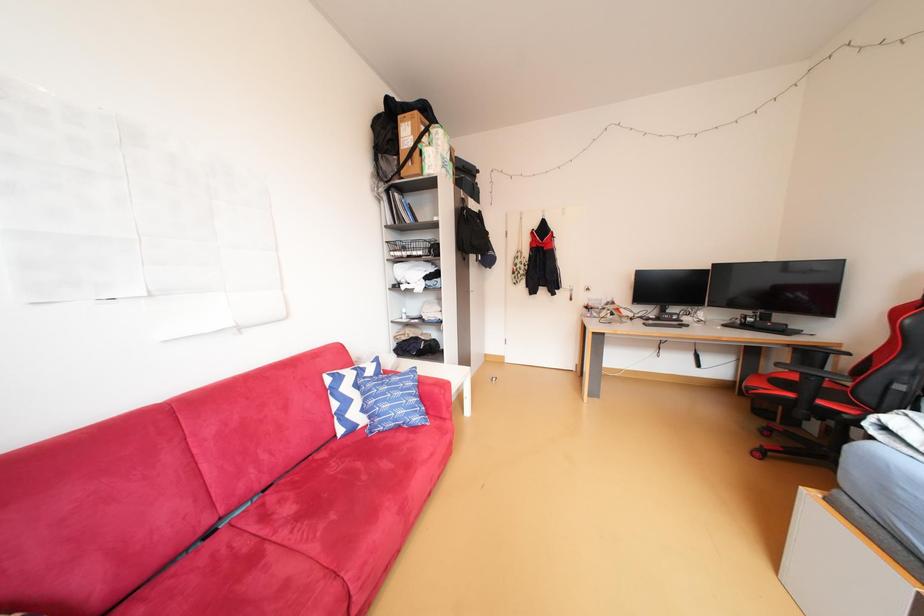
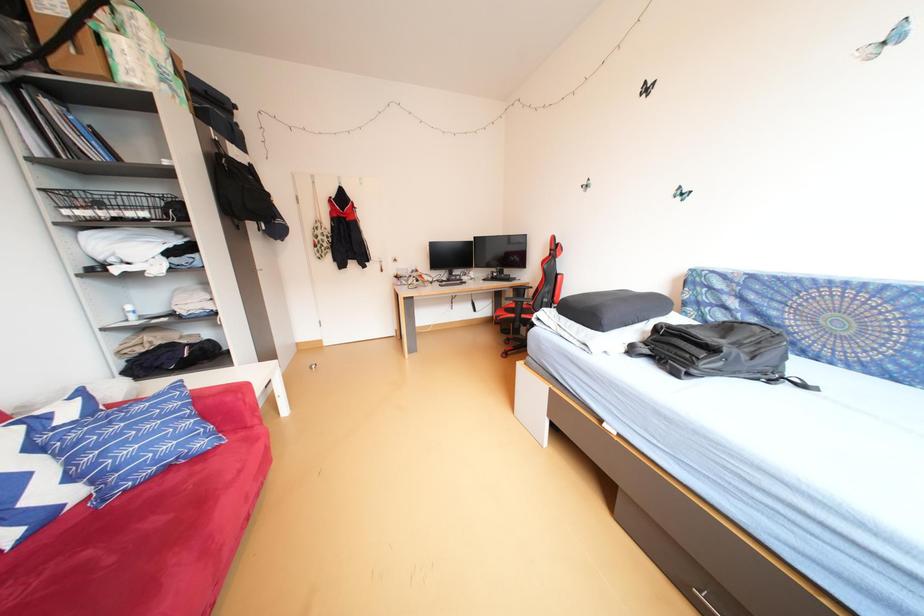
Question: The camera is either moving clockwise (left) or counter-clockwise (right) around the object. The first image is from the beginning of the video and the second image is from the end. Is the camera moving left or right when shooting the video?

Choices:
 (A) Left
 (B) Right

Answer: (A)